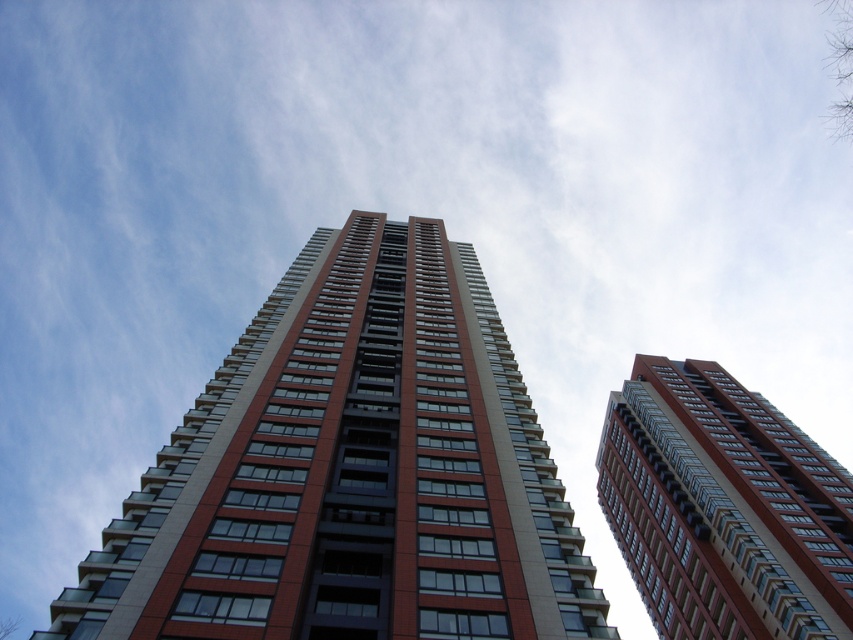
You are standing at the base of the two tall buildings and want to take a photo of both the red brick building at center and the matte red building at center. Which building should you look up towards more to include in your photo?

The red brick building at center is located above the matte red building at center, so you should look up more to capture the red brick building at center in your photo.

In the scene shown: You are standing in front of two tall buildings. You see the red brick building at center and the matte red building at center. Which one is more to the left?

The red brick building at center is positioned on the left side of matte red building at center, so it is more to the left.